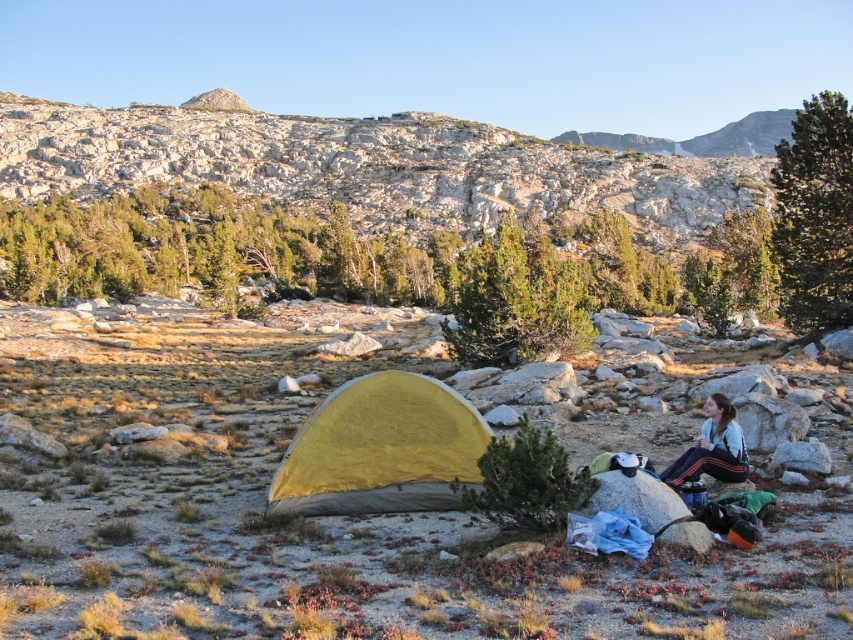
From the picture: Does yellow fabric tent at lower center have a lesser height compared to white fleece jacket at lower right?

Incorrect, yellow fabric tent at lower center's height does not fall short of white fleece jacket at lower right's.

Which is in front, point (410, 390) or point (726, 451)?

Point (410, 390) is in front.

The width and height of the screenshot is (853, 640). In order to click on yellow fabric tent at lower center in this screenshot , I will do `click(381, 449)`.